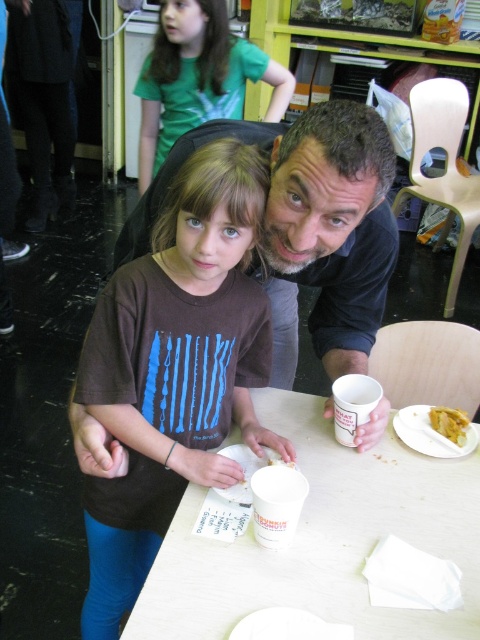
Question: Can you confirm if white paper plate at lower center is positioned to the left of yellow matte bread at lower right?

Choices:
 (A) yes
 (B) no

Answer: (A)

Question: Which object is the farthest from the yellow matte bread at lower right?

Choices:
 (A) white paper plate at lower center
 (B) brown cotton shirt at center
 (C) dark blue shirt at center
 (D) green t-shirt at upper left

Answer: (D)

Question: Does dark blue shirt at center have a greater width compared to green t-shirt at upper left?

Choices:
 (A) yes
 (B) no

Answer: (B)

Question: Can you confirm if brown cotton shirt at center is positioned above dark blue shirt at center?

Choices:
 (A) yes
 (B) no

Answer: (B)

Question: Which point is closer to the camera?

Choices:
 (A) click(429, 413)
 (B) click(175, 144)
 (C) click(103, 616)

Answer: (B)

Question: Among these points, which one is farthest from the camera?

Choices:
 (A) [x=278, y=243]
 (B) [x=420, y=616]
 (C) [x=135, y=451]

Answer: (C)